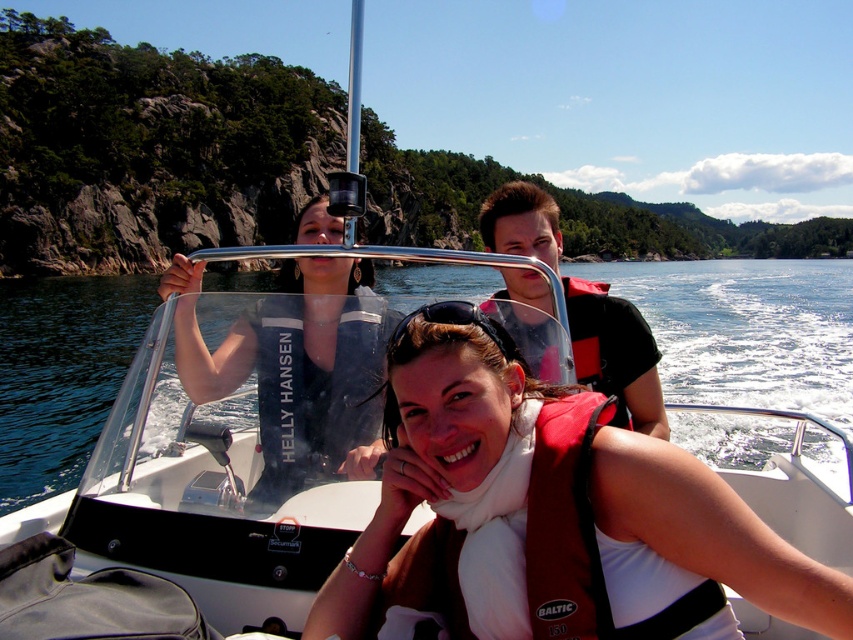
You are a passenger on the boat and want to take a photo of the clear blue water at center and the matte black jacket at upper center. Which object should you point your camera towards first to capture both in the same frame?

To capture both the clear blue water at center and the matte black jacket at upper center in the same frame, you should point your camera towards the clear blue water at center first since it is located above the matte black jacket at upper center.

You are a safety inspector checking the boat. You notice the brown fabric life vest at center and the black rubber goggles at center. According to safety regulations, life vests must be visible and not obstructed by other equipment. Is the current arrangement compliant?

The brown fabric life vest at center is positioned under black rubber goggles at center, which means it is obstructed by the goggles. This violates safety regulations as the life vest must be visible and not obstructed. The arrangement is not compliant.